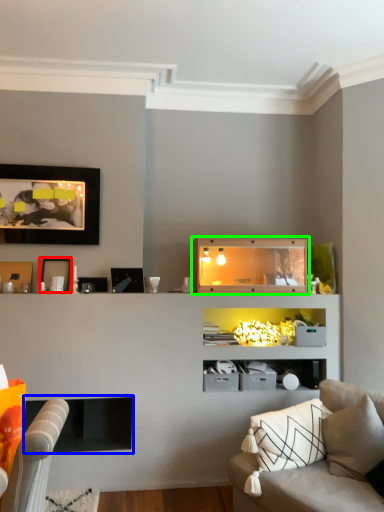
Question: Which is nearer to the picture frame (highlighted by a red box)? fireplace (highlighted by a blue box) or shelf (highlighted by a green box).

Choices:
 (A) fireplace
 (B) shelf

Answer: (A)